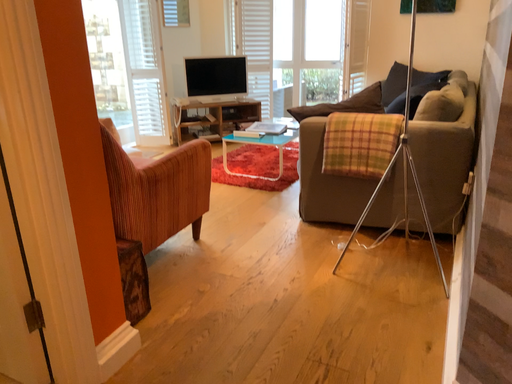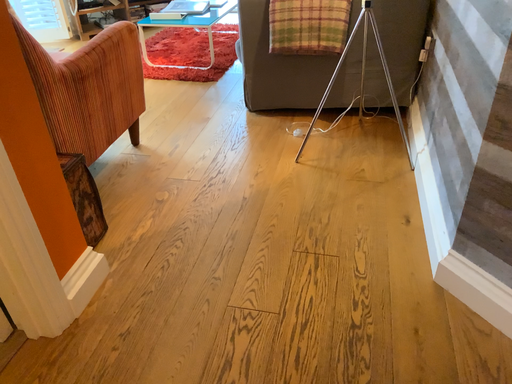
Question: How did the camera likely rotate when shooting the video?

Choices:
 (A) rotated upward
 (B) rotated downward

Answer: (B)